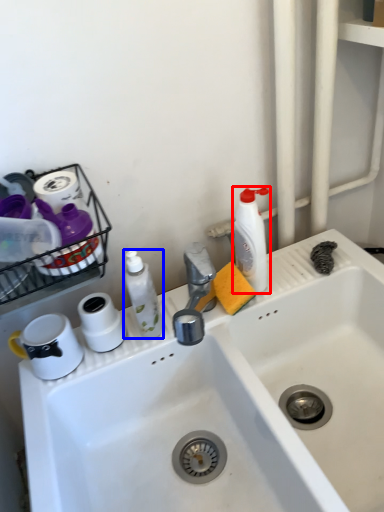
Question: Which point is further to the camera, cleaning product (highlighted by a red box) or cleaning product (highlighted by a blue box)?

Choices:
 (A) cleaning product
 (B) cleaning product

Answer: (A)